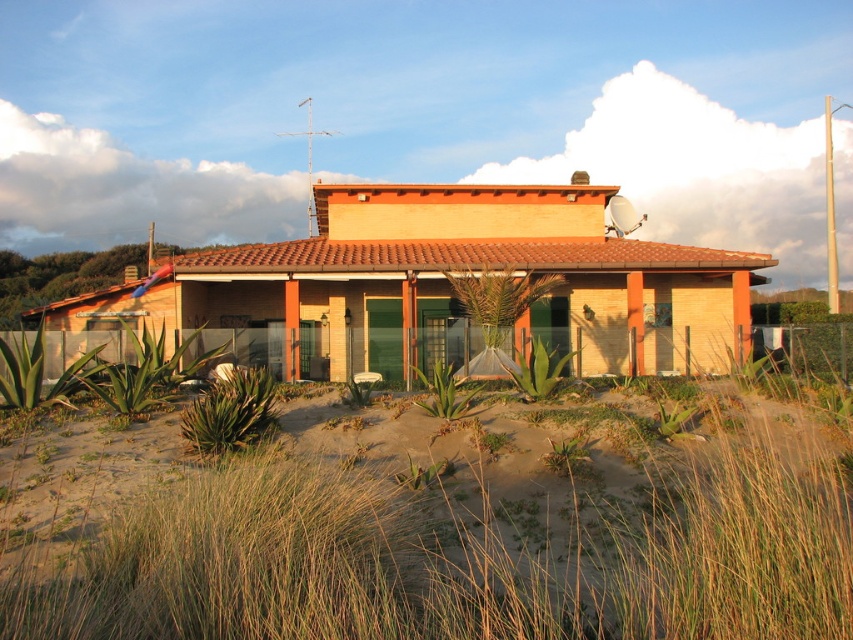
Question: Does brown sandy beach at lower center have a larger size compared to matte orange house at center?

Choices:
 (A) no
 (B) yes

Answer: (A)

Question: Can you confirm if brown sandy beach at lower center is positioned to the left of matte orange house at center?

Choices:
 (A) yes
 (B) no

Answer: (B)

Question: From the image, what is the correct spatial relationship of brown sandy beach at lower center in relation to matte orange house at center?

Choices:
 (A) right
 (B) left

Answer: (A)

Question: Which of the following is the closest to the observer?

Choices:
 (A) (392, 570)
 (B) (641, 360)

Answer: (A)

Question: Which of the following is the closest to the observer?

Choices:
 (A) click(x=838, y=529)
 (B) click(x=548, y=211)

Answer: (A)